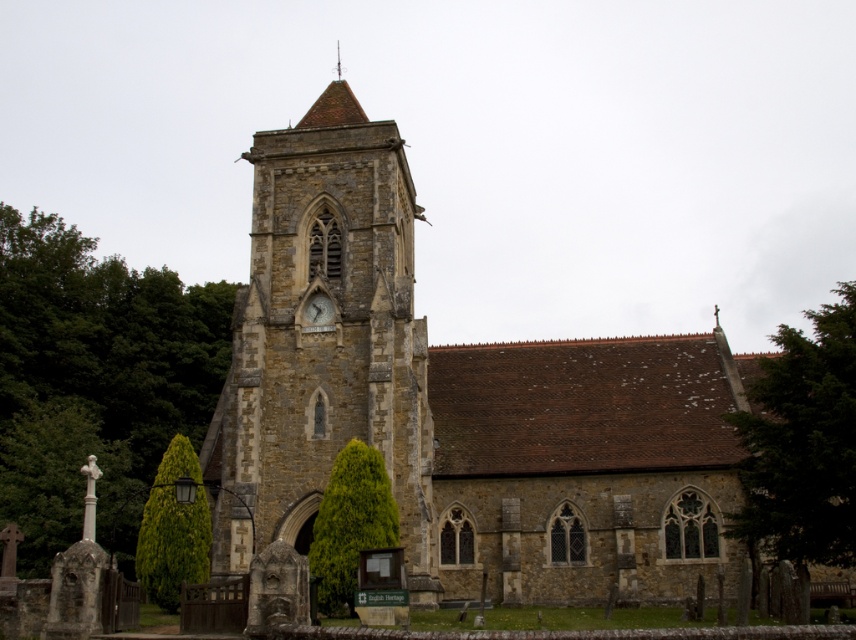
Is point (379, 545) closer to viewer compared to point (331, 308)?

Yes, it is.

Between point (379, 477) and point (333, 312), which one is positioned behind?

The point (333, 312) is more distant.

Where is `green leafy tree at center`? Image resolution: width=856 pixels, height=640 pixels. green leafy tree at center is located at coordinates (349, 524).

Is point (385, 330) closer to camera compared to point (274, 416)?

Yes.

Can you confirm if brown stone church at center is shorter than brown stone clock tower at center?

Incorrect, brown stone church at center's height does not fall short of brown stone clock tower at center's.

Locate an element on the screen. brown stone church at center is located at coordinates (455, 404).

Between point (199, 328) and point (308, 323), which one is positioned in front?

Point (308, 323)

Is green leafy tree at left bigger than matte stone clock at center?

Yes.

Where is `green leafy tree at left`? green leafy tree at left is located at coordinates (94, 380).

Find the location of a particular element. The image size is (856, 640). green leafy tree at left is located at coordinates (94, 380).